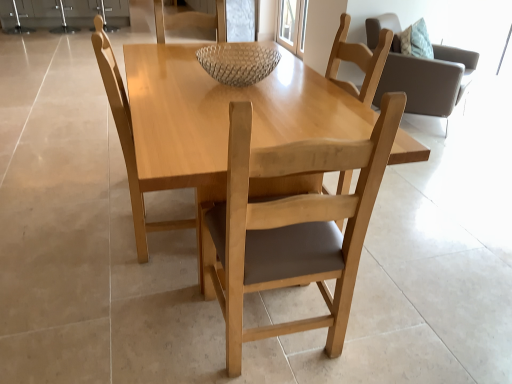
Question: Is light wood chair at center, which appears as the third chair when viewed from the right, to the left or to the right of light brown wood chair at upper right, the third chair viewed from the left, in the image?

Choices:
 (A) left
 (B) right

Answer: (A)

Question: In terms of size, does light wood chair at center, which appears as the third chair when viewed from the right, appear bigger or smaller than light brown wood chair at upper right, which ranks as the first chair in back-to-front order?

Choices:
 (A) big
 (B) small

Answer: (B)

Question: Which is farther from the light wood chair at center, which is the third chair in back-to-front order?

Choices:
 (A) light brown wood chair at upper right, the third chair viewed from the left
 (B) transparent glass door at upper center
 (C) clear glass bowl at center
 (D) light wood chair at center, which is the 2th chair in back-to-front order
 (E) light wood table at center

Answer: (B)

Question: Considering the real-world distances, which object is closest to the transparent glass door at upper center?

Choices:
 (A) light wood chair at center, the second chair from the front
 (B) light brown wood chair at upper right, which ranks as the first chair in back-to-front order
 (C) clear glass bowl at center
 (D) light wood table at center
 (E) light wood chair at center, which is the third chair in back-to-front order

Answer: (B)